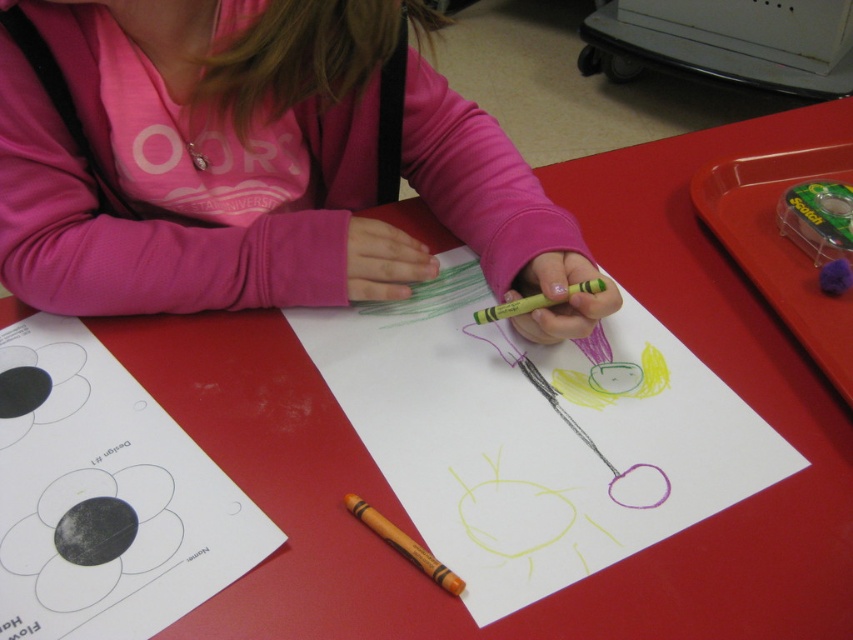
Question: Which point is closer to the camera taking this photo?

Choices:
 (A) (x=483, y=593)
 (B) (x=32, y=160)
 (C) (x=585, y=284)
 (D) (x=141, y=433)

Answer: (A)

Question: Is white paper at center to the right of matte yellow crayon at center from the viewer's perspective?

Choices:
 (A) yes
 (B) no

Answer: (B)

Question: Is pink fleece shirt at upper center bigger than yellow matte crayon at center?

Choices:
 (A) yes
 (B) no

Answer: (A)

Question: Among these objects, which one is nearest to the camera?

Choices:
 (A) yellow matte crayon at center
 (B) white paper at center
 (C) matte yellow crayon at center
 (D) colored paper at center

Answer: (B)

Question: Is white paper at center above matte yellow crayon at center?

Choices:
 (A) no
 (B) yes

Answer: (B)

Question: Which of the following is the closest to the observer?

Choices:
 (A) (403, 545)
 (B) (554, 300)
 (C) (357, 404)

Answer: (A)